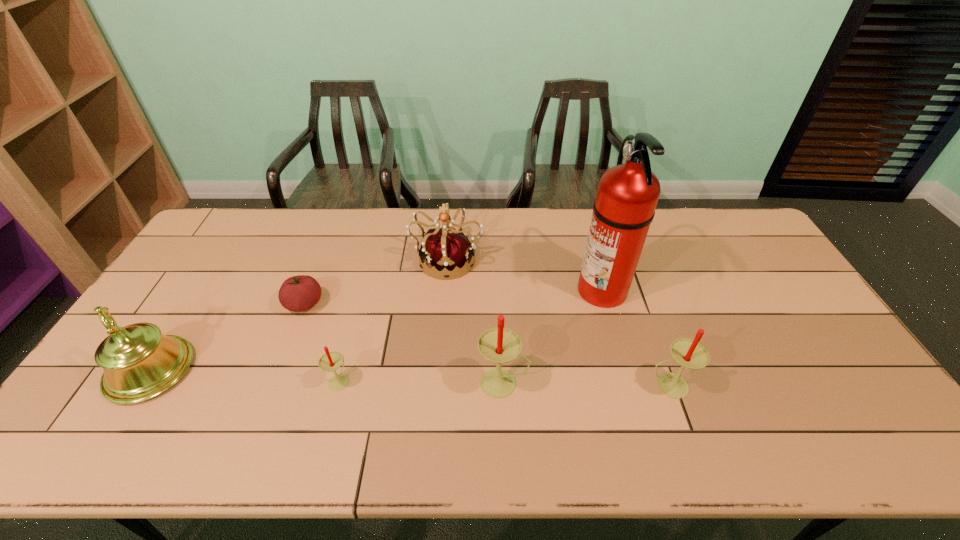
This screenshot has height=540, width=960. I want to click on the second closest candle relative to the tiara, so click(331, 361).

Locate an element on the screen. vacant region that satisfies the following two spatial constraints: 1. on the front-facing side of the tiara; 2. on the right side of the second candle from right to left is located at coordinates (437, 383).

At what (x,y) coordinates should I click in order to perform the action: click on vacant area in the image that satisfies the following two spatial constraints: 1. on the front-facing side of the second candle from left to right; 2. on the right side of the tiara. Please return your answer as a coordinate pair (x, y). The height and width of the screenshot is (540, 960). Looking at the image, I should click on (437, 383).